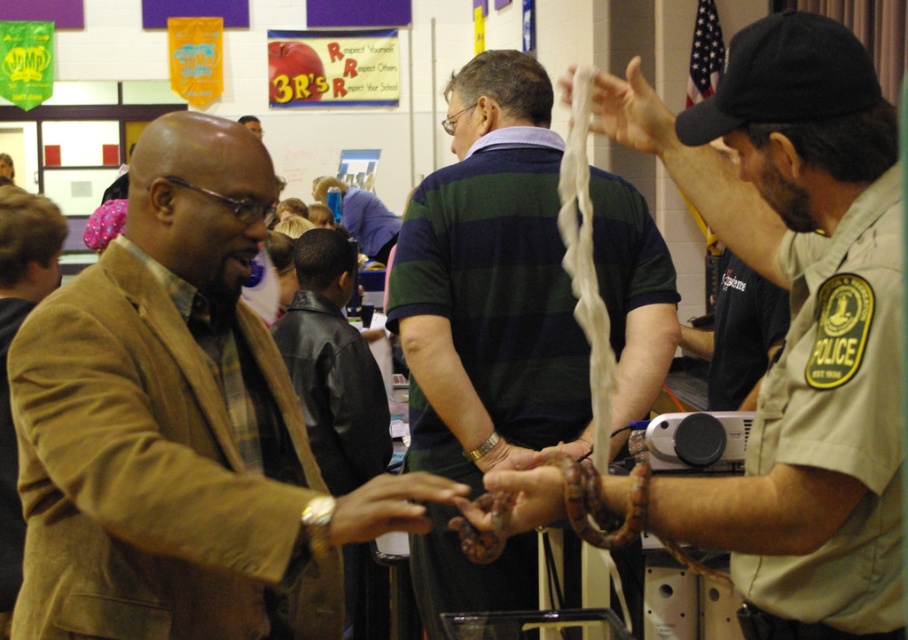
You are standing in the hallway and want to shake hands with both the person in the brown leather jacket at left and the person in the green striped shirt at center. Which person should you approach first to be polite?

You should approach the brown leather jacket at left first since it is positioned on the left side of the green striped shirt at center, so it is closer to you.

You are a student observing the scene in the hallway. You notice the smooth brown snake at center and the brown woolen jacket at left. Which object is wider?

The smooth brown snake at center is wider than the brown woolen jacket at left.